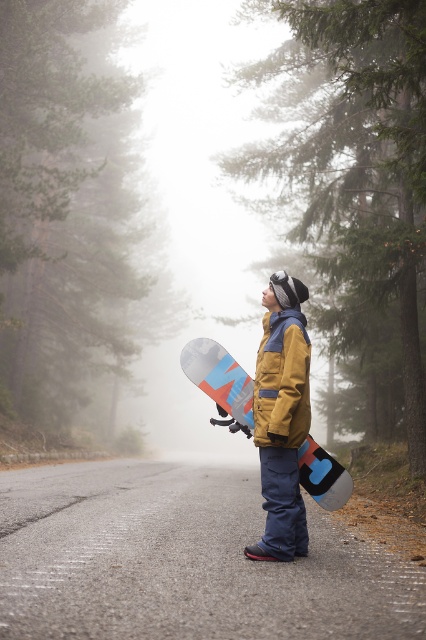
Can you confirm if yellow fabric snowboarder at center is bigger than matte blue snowboard at center?

Yes.

The image size is (426, 640). What do you see at coordinates (282, 417) in the screenshot? I see `yellow fabric snowboarder at center` at bounding box center [282, 417].

What are the coordinates of `yellow fabric snowboarder at center` in the screenshot? It's located at (282, 417).

Locate an element on the screen. yellow fabric snowboarder at center is located at coordinates (282, 417).